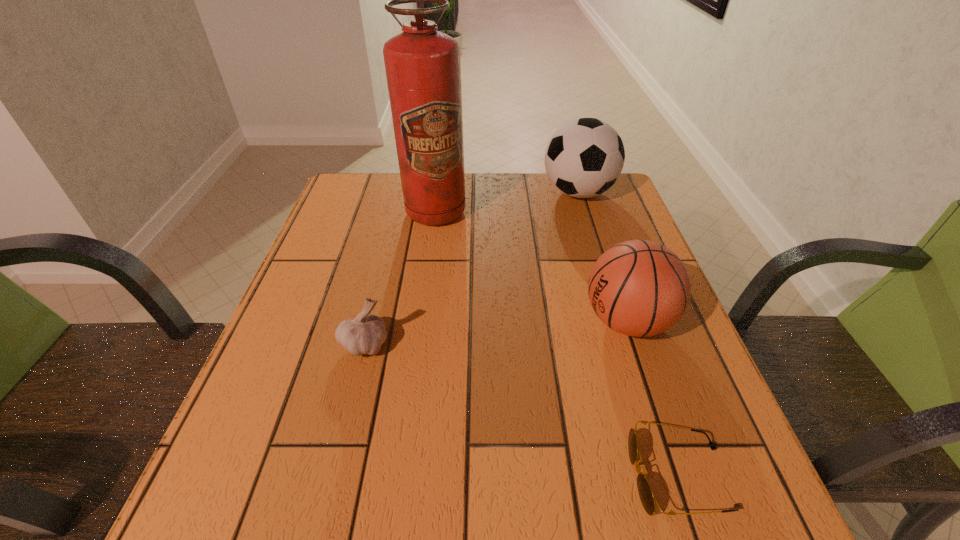
This screenshot has height=540, width=960. Identify the location of unoccupied position between the shortest object and the garlic. 521,411.

In order to click on empty space between the basketball and the fourth tallest object in this screenshot , I will do `click(495, 333)`.

Where is `vacant space that is in between the soccer ball and the tallest object`? vacant space that is in between the soccer ball and the tallest object is located at coordinates (507, 202).

Identify the location of vacant space in between the sunglasses and the garlic. pyautogui.click(x=521, y=411).

This screenshot has width=960, height=540. Identify the location of free space between the third shortest object and the garlic. (495, 333).

At what (x,y) coordinates should I click in order to perform the action: click on free space between the fourth tallest object and the soccer ball. Please return your answer as a coordinate pair (x, y). The height and width of the screenshot is (540, 960). Looking at the image, I should click on (471, 268).

Identify the location of vacant point located between the garlic and the soccer ball. (471, 268).

The height and width of the screenshot is (540, 960). I want to click on vacant area that lies between the soccer ball and the fire extinguisher, so click(x=507, y=202).

This screenshot has width=960, height=540. I want to click on the third closest object to the soccer ball, so click(x=365, y=334).

Identify which object is the fourth closest to the third shortest object. Please provide its 2D coordinates. Your answer should be formatted as a tuple, i.e. [(x, y)], where the tuple contains the x and y coordinates of a point satisfying the conditions above.

[(365, 334)]